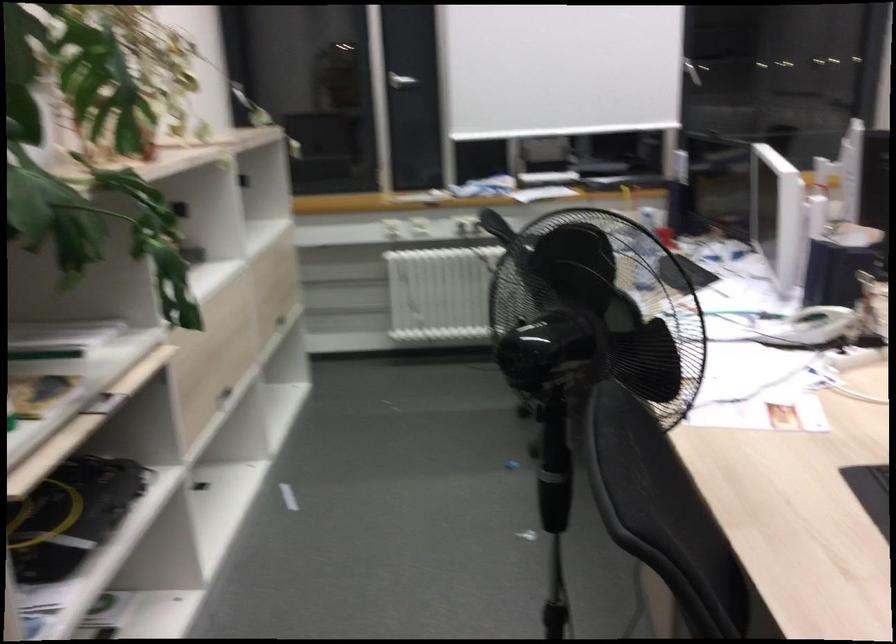
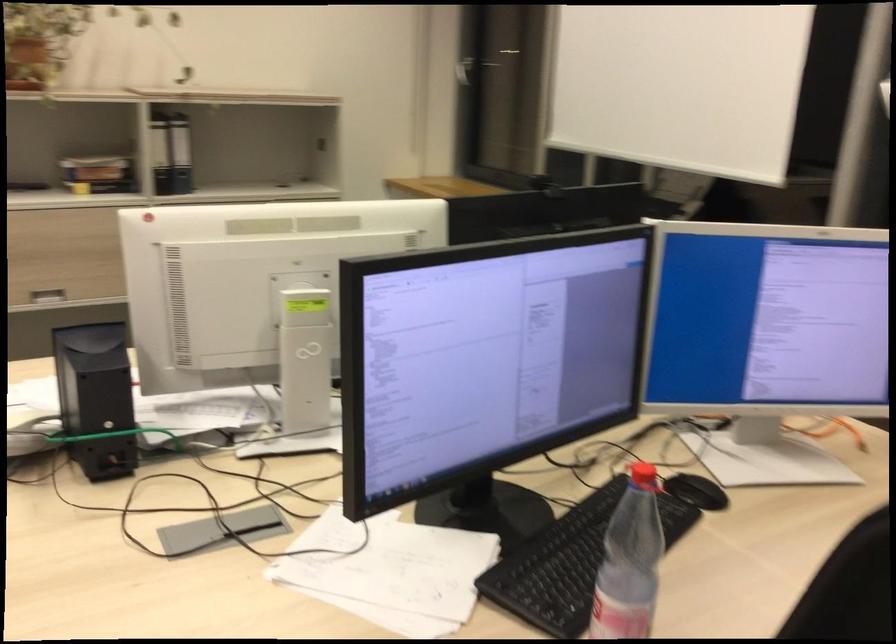
Question: I am providing you with two images of the same scene from different viewpoints. After the viewpoint changes to image2, which objects are now occluded?

Choices:
 (A) silver cabinet handle
 (B) drawer handle
 (C) plastic water bottle
 (D) multimeter dial

Answer: (B)